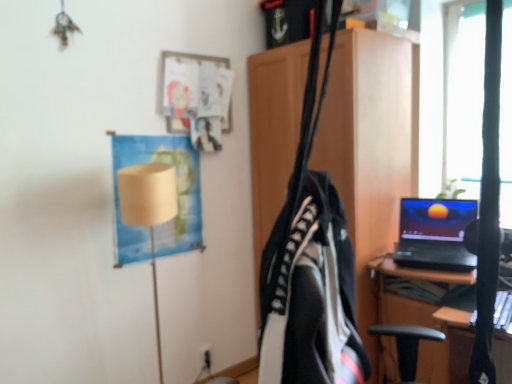
Question: Can you confirm if wooden cabinet at center is smaller than black plastic electric outlet at lower center?

Choices:
 (A) no
 (B) yes

Answer: (A)

Question: From the image's perspective, is wooden cabinet at center over black plastic electric outlet at lower center?

Choices:
 (A) no
 (B) yes

Answer: (B)

Question: Is wooden cabinet at center looking in the opposite direction of black plastic electric outlet at lower center?

Choices:
 (A) no
 (B) yes

Answer: (A)

Question: Could you tell me if wooden cabinet at center is facing black plastic electric outlet at lower center?

Choices:
 (A) no
 (B) yes

Answer: (B)

Question: Does wooden cabinet at center appear on the right side of black plastic electric outlet at lower center?

Choices:
 (A) yes
 (B) no

Answer: (A)

Question: In terms of height, does beige paper lampshade at upper left look taller or shorter compared to black fabric backpack at center?

Choices:
 (A) short
 (B) tall

Answer: (A)

Question: From a real-world perspective, is beige paper lampshade at upper left positioned above or below black fabric backpack at center?

Choices:
 (A) below
 (B) above

Answer: (B)

Question: Visually, is beige paper lampshade at upper left positioned to the left or to the right of black fabric backpack at center?

Choices:
 (A) left
 (B) right

Answer: (A)

Question: Is beige paper lampshade at upper left inside the boundaries of black fabric backpack at center, or outside?

Choices:
 (A) outside
 (B) inside

Answer: (A)

Question: From the image's perspective, is wooden cabinet at center above or below beige paper lampshade at upper left?

Choices:
 (A) below
 (B) above

Answer: (A)

Question: Considering the positions of wooden cabinet at center and beige paper lampshade at upper left in the image, is wooden cabinet at center taller or shorter than beige paper lampshade at upper left?

Choices:
 (A) tall
 (B) short

Answer: (A)

Question: Would you say wooden cabinet at center is to the left or to the right of beige paper lampshade at upper left in the picture?

Choices:
 (A) left
 (B) right

Answer: (B)

Question: Based on their sizes in the image, would you say wooden cabinet at center is bigger or smaller than beige paper lampshade at upper left?

Choices:
 (A) big
 (B) small

Answer: (A)

Question: Which is correct: wooden cabinet at center is inside beige fabric lampshade at left, or outside of it?

Choices:
 (A) outside
 (B) inside

Answer: (A)

Question: From a real-world perspective, is wooden cabinet at center above or below beige fabric lampshade at left?

Choices:
 (A) below
 (B) above

Answer: (B)